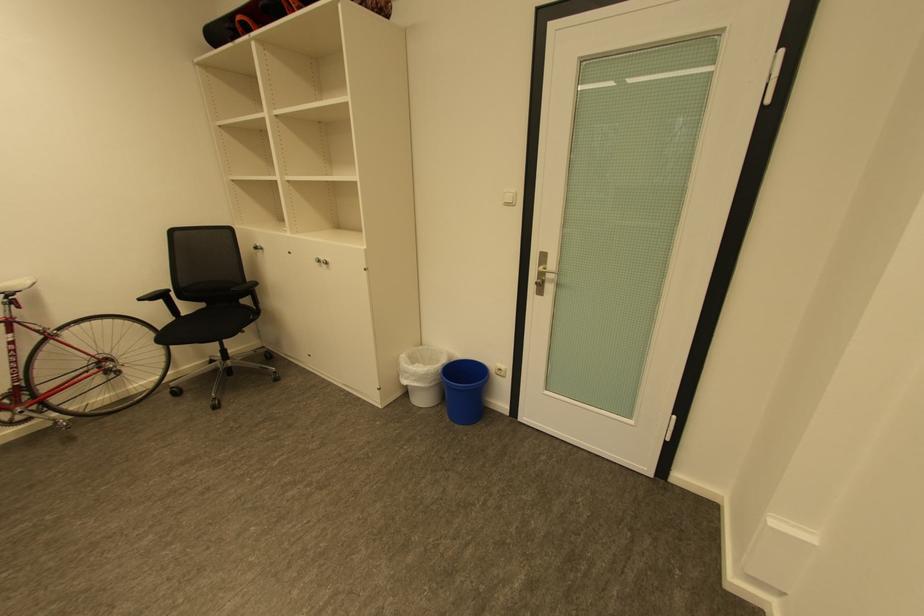
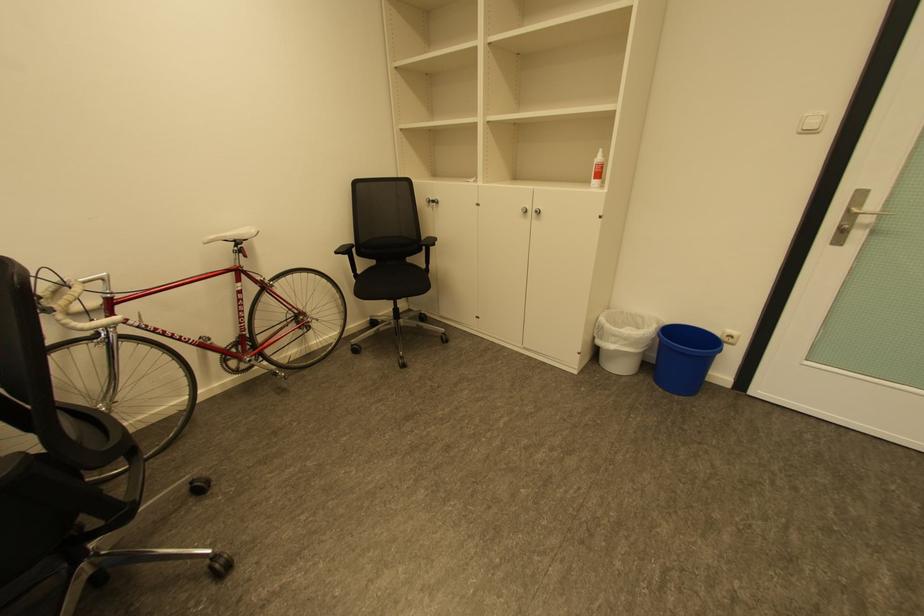
Where in the second image is the point corresponding to pixel 252 301 from the first image?

(426, 259)